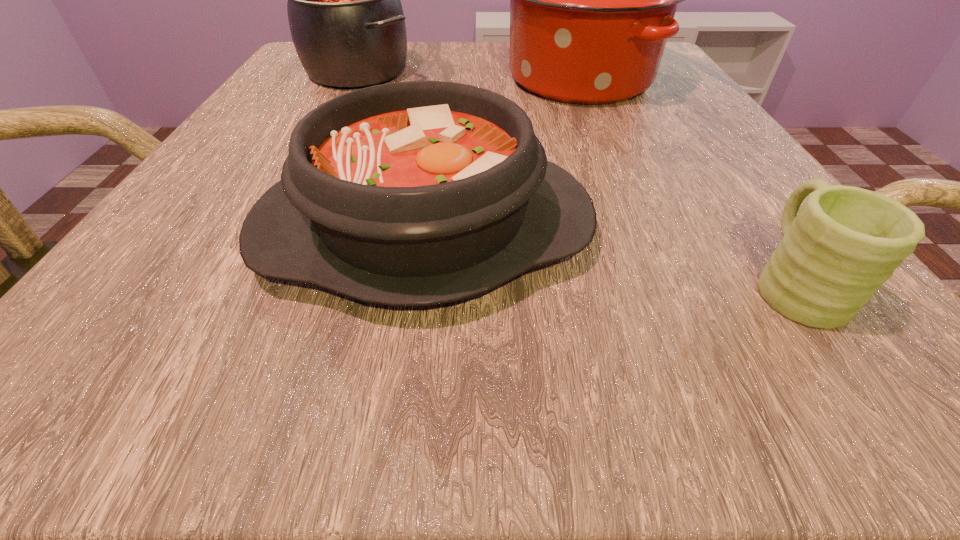
Where is `blank area at the near left corner`? blank area at the near left corner is located at coordinates (143, 381).

What are the coordinates of `free space at the far right corner` in the screenshot? It's located at (675, 75).

Find the location of a particular element. The image size is (960, 540). free area in between the tallest casserole and the shortest object is located at coordinates (686, 180).

Locate an element on the screen. The width and height of the screenshot is (960, 540). free space between the tallest object and the shortest object is located at coordinates (686, 180).

Identify the location of free point between the tallest object and the mug. Image resolution: width=960 pixels, height=540 pixels. (686, 180).

This screenshot has height=540, width=960. I want to click on the second closest object to the tallest object, so click(x=416, y=193).

Select which object appears as the closest to the shortest object. Please provide its 2D coordinates. Your answer should be formatted as a tuple, i.e. [(x, y)], where the tuple contains the x and y coordinates of a point satisfying the conditions above.

[(416, 193)]

Locate an element on the screen. The width and height of the screenshot is (960, 540). casserole identified as the second closest to the tallest casserole is located at coordinates (416, 193).

Where is `the second closest casserole to the shortest object`? The height and width of the screenshot is (540, 960). the second closest casserole to the shortest object is located at coordinates pyautogui.click(x=592, y=0).